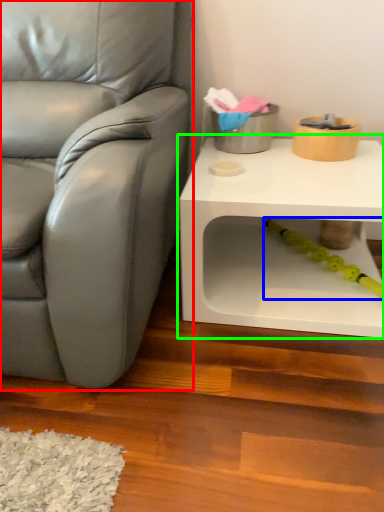
Question: Estimate the real-world distances between objects in this image. Which object is closer to chair (highlighted by a red box), toy (highlighted by a blue box) or table (highlighted by a green box)?

Choices:
 (A) toy
 (B) table

Answer: (B)